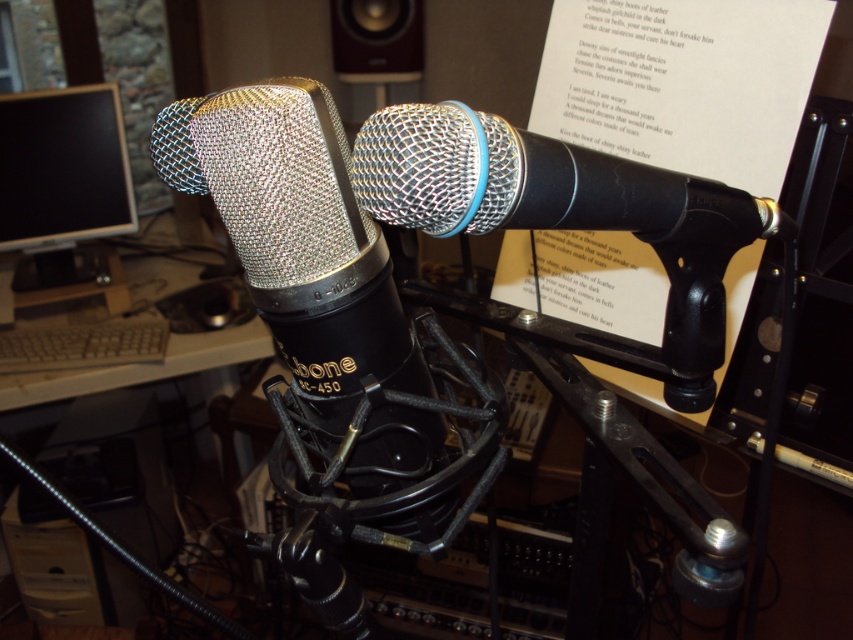
You are setting up a recording studio and need to place the silver mesh microphone at center and the matte brown speaker at upper center on a shelf. The shelf has limited height space. Based on their sizes, which object might not fit if the shelf has a height restriction?

The matte brown speaker at upper center might not fit because the silver mesh microphone at center is not as tall as it, indicating the speaker is taller.

You are a technician adjusting the position of the black glossy monitor at left. If your arm reaches 1.7 meters, can you comfortably adjust the monitor without moving your position?

The black glossy monitor at left is 1.86 meters from the camera, which is slightly beyond your arm reach of 1.7 meters. You may need to move closer to adjust it comfortably.

You are setting up a home office and need to place both the black glossy monitor at left and the gray plastic keyboard at lower left on your desk. Given their sizes, which one should you place first to ensure proper positioning?

The black glossy monitor at left is larger in size than the gray plastic keyboard at lower left, so you should place the black glossy monitor at left first to account for its larger space requirements.